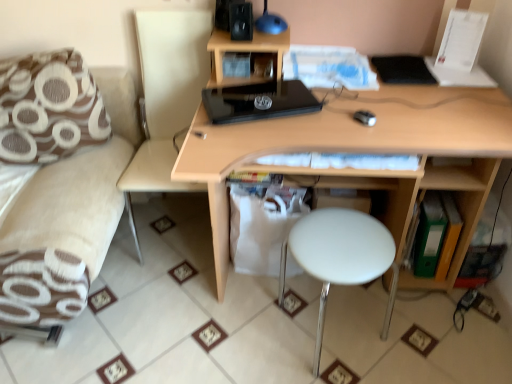
Identify the location of vacant space in front of beige fabric swivel chair at left. This screenshot has width=512, height=384. (186, 299).